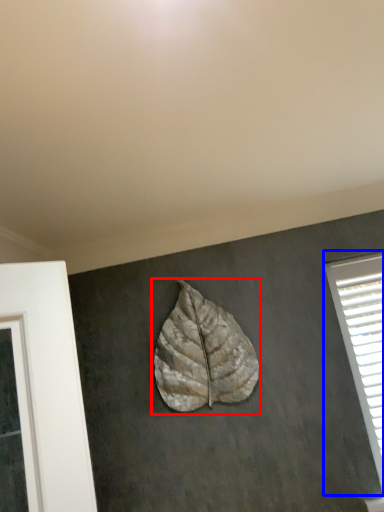
Question: Among these objects, which one is farthest to the camera, leaf (highlighted by a red box) or window (highlighted by a blue box)?

Choices:
 (A) leaf
 (B) window

Answer: (B)